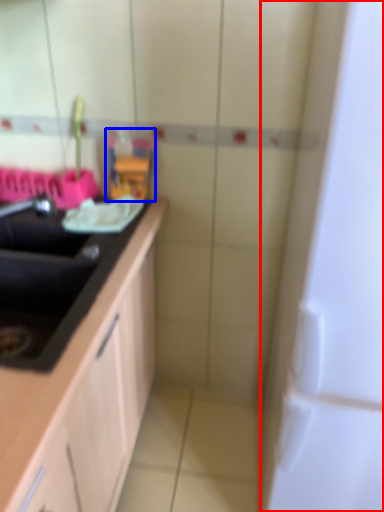
Question: Among these objects, which one is nearest to the camera, appliance (highlighted by a red box) or toy (highlighted by a blue box)?

Choices:
 (A) appliance
 (B) toy

Answer: (A)